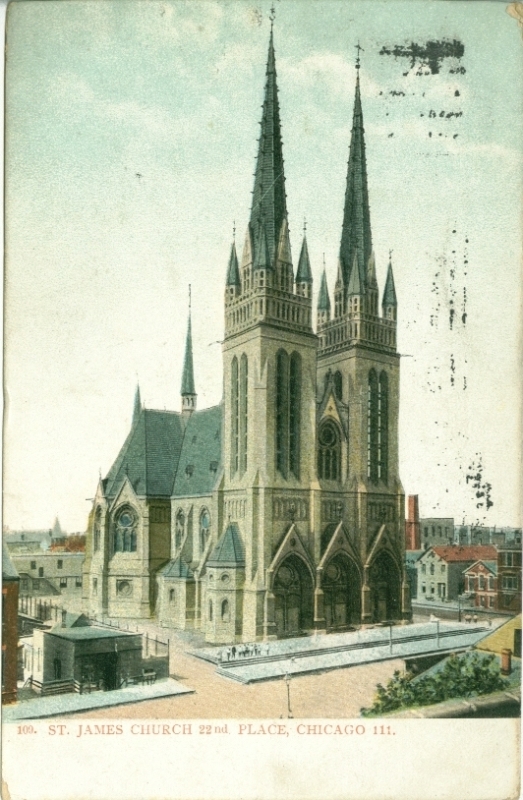
Find the location of a particular element. chimney is located at coordinates (505, 658).